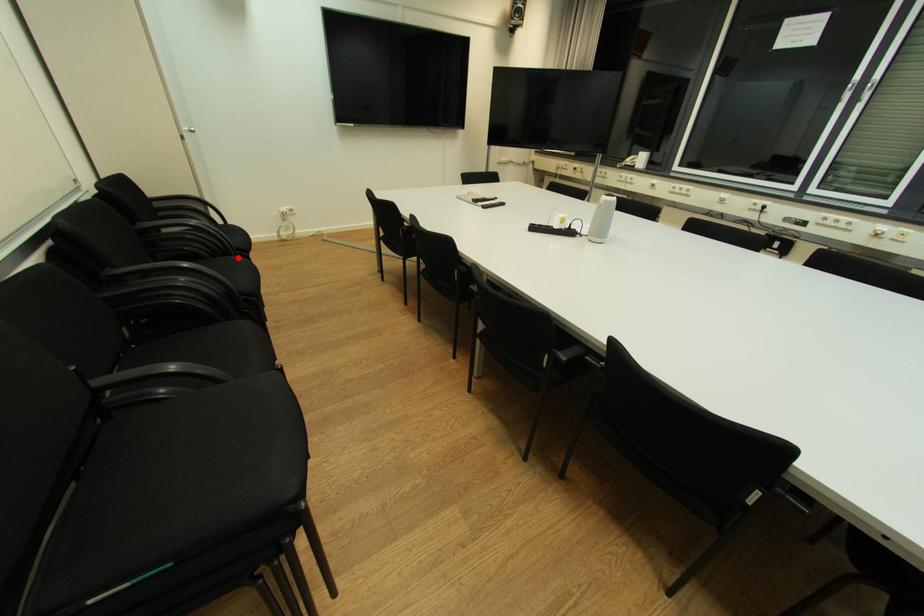
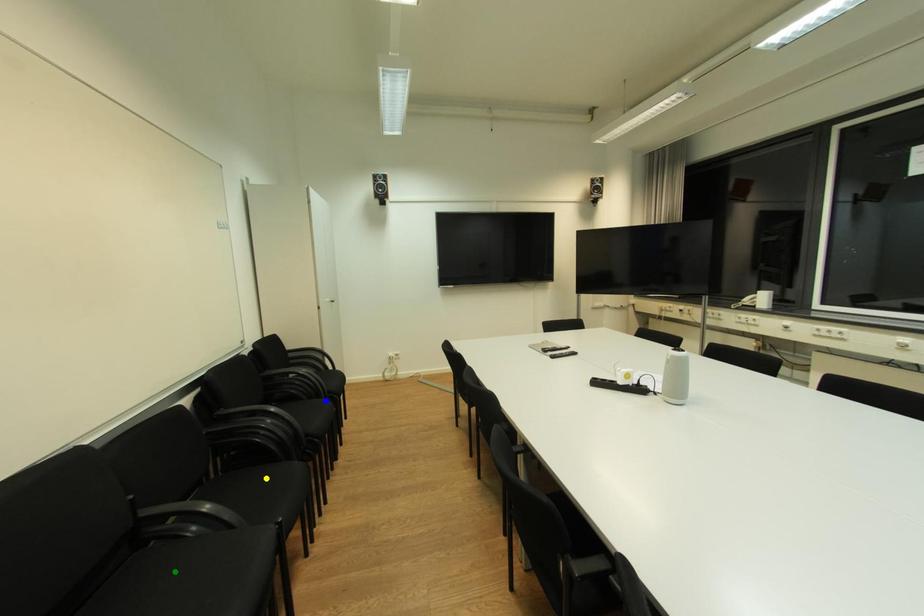
Question: I am providing you with two images of the same scene from different viewpoints. A red point is marked on the first image. You are given multiple points on the second image. In image 2, which mark is for the same physical point as the one in image 1?

Choices:
 (A) blue point
 (B) yellow point
 (C) green point

Answer: (A)